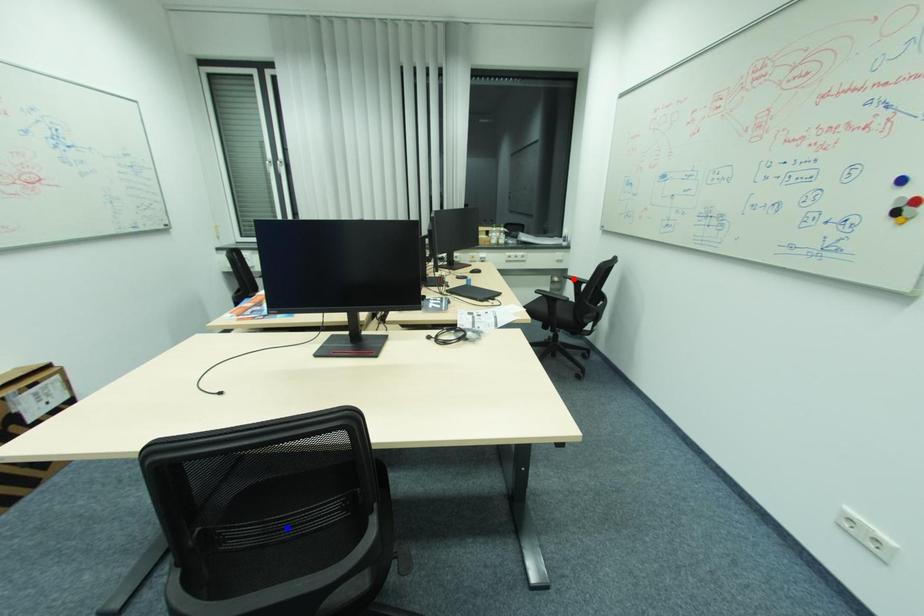
Question: In the image, two points are highlighted. Which point is nearer to the camera? Reply with the corresponding letter.

Choices:
 (A) blue point
 (B) red point

Answer: (A)